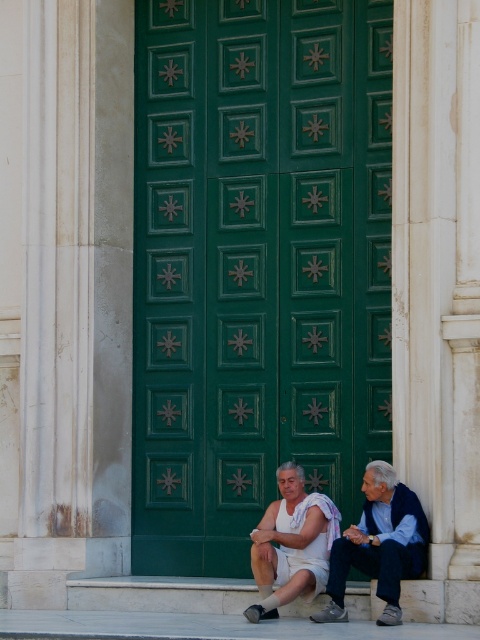
You are standing in front of the green door and want to place a small potted plant exactly at the point marked by the coordinates point (256, 266). Based on the scene description, where will the plant be placed relative to the green painted wood door at center?

The point (256, 266) corresponds to the green painted wood door at center, so the plant will be placed directly on the door.

You are a painter who needs to decide whether to bring a ladder or a step stool to paint the green painted wood door at center. Considering the height of the light blue denim jeans at lower right, can you determine if the door is tall enough to require a ladder?

The green painted wood door at center is wider than the light blue denim jeans at lower right, but the height comparison isn not provided. Therefore, I cannot determine if a ladder is needed based on the given information.

You are standing in front of the green door with star patterns and want to sit down next to the white cotton shorts at center. Which direction should you move to avoid the light blue denim jeans at lower right?

You should move to the left side of the white cotton shorts at center since the light blue denim jeans at lower right is located to its right.